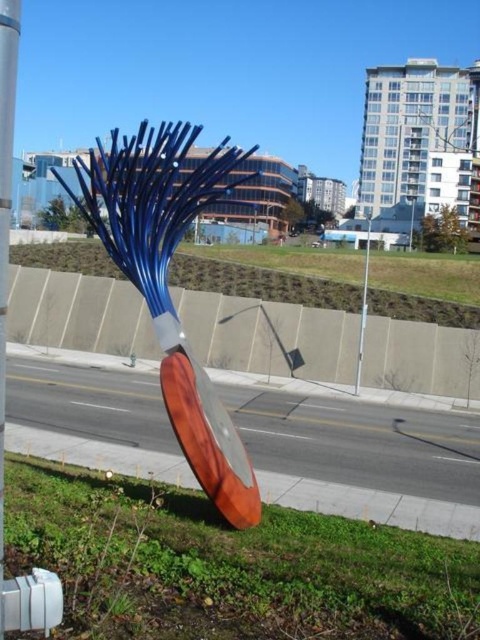
You are standing in front of the urban sculpture and want to take a photo that includes both the point at coordinates point (305, 595) and point (4, 230). Based on their positions, which point will appear closer to the camera in your photo?

Point (4, 230) will appear closer to the camera in your photo because it is physically closer to the viewer than point (305, 595), which is further away.

You are a city planner reviewing the sculpture design. The sculpture has green grass at lower center and a metallic silver pole at center. Which object is positioned lower in the image?

The green grass at lower center is positioned lower than the metallic silver pole at center in the image.

Looking at this image, you are an architect inspecting the urban sculpture. You notice two poles at the center of the sculpture labeled as smooth silver pole at center and metallic silver pole at center. Which of these two poles is thinner?

The smooth silver pole at center is thinner than the metallic silver pole at center.